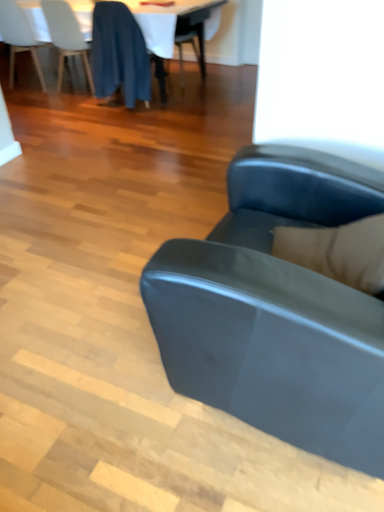
Question: From the image's perspective, is white fabric table at upper center over matte black couch at center?

Choices:
 (A) yes
 (B) no

Answer: (A)

Question: Is white fabric table at upper center next to matte black couch at center and touching it?

Choices:
 (A) no
 (B) yes

Answer: (A)

Question: From the image's perspective, is white fabric table at upper center beneath matte black couch at center?

Choices:
 (A) yes
 (B) no

Answer: (B)

Question: From a real-world perspective, does white fabric table at upper center sit lower than matte black couch at center?

Choices:
 (A) yes
 (B) no

Answer: (A)

Question: Is white fabric table at upper center thinner than matte black couch at center?

Choices:
 (A) yes
 (B) no

Answer: (B)

Question: Is white fabric table at upper center wider than matte black couch at center?

Choices:
 (A) yes
 (B) no

Answer: (A)

Question: Is matte black couch at center aimed at white matte chair at upper left, the 1th chair in the left-to-right sequence?

Choices:
 (A) no
 (B) yes

Answer: (A)

Question: Can you confirm if matte black couch at center is positioned to the right of white matte chair at upper left, the 1th chair in the left-to-right sequence?

Choices:
 (A) no
 (B) yes

Answer: (B)

Question: From a real-world perspective, is matte black couch at center below white matte chair at upper left, the third chair positioned from the right?

Choices:
 (A) yes
 (B) no

Answer: (B)

Question: Is matte black couch at center wider than white matte chair at upper left, the third chair positioned from the right?

Choices:
 (A) yes
 (B) no

Answer: (A)

Question: Can you confirm if matte black couch at center is smaller than white matte chair at upper left, the 1th chair in the left-to-right sequence?

Choices:
 (A) yes
 (B) no

Answer: (B)

Question: Is matte black couch at center bigger than white matte chair at upper left, the 1th chair in the left-to-right sequence?

Choices:
 (A) no
 (B) yes

Answer: (B)

Question: Is white matte chair at upper left, the 1th chair in the left-to-right sequence, in front of white glossy table at upper center?

Choices:
 (A) yes
 (B) no

Answer: (B)